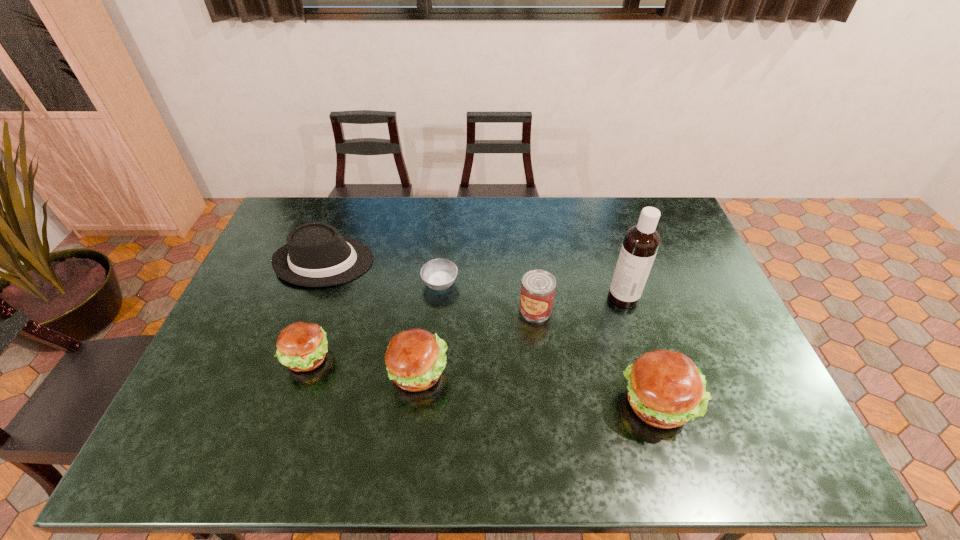
This screenshot has height=540, width=960. I want to click on the shortest hamburger, so click(x=301, y=346).

You are a GUI agent. You are given a task and a screenshot of the screen. Output one action in this format:
    pyautogui.click(x=<x>, y=<y>)
    Task: Click on the second tallest hamburger
    
    Given the screenshot: What is the action you would take?
    pyautogui.click(x=415, y=358)

Where is `the rightmost hamburger`? the rightmost hamburger is located at coordinates (665, 389).

This screenshot has width=960, height=540. What are the coordinates of `ashtray` in the screenshot? It's located at 439,274.

Identify the location of dishwasher detergent. (641, 242).

Where is `fedora`? The height and width of the screenshot is (540, 960). fedora is located at coordinates (315, 255).

Find the location of a particular element. The width and height of the screenshot is (960, 540). can is located at coordinates (538, 287).

Identify the location of vacant area located on the right of the shortest hamburger. (400, 358).

Locate an element on the screen. This screenshot has height=540, width=960. vacant space located 0.270m on the back of the second tallest hamburger is located at coordinates (429, 278).

Where is `free point located on the back of the rightmost hamburger`? free point located on the back of the rightmost hamburger is located at coordinates (633, 325).